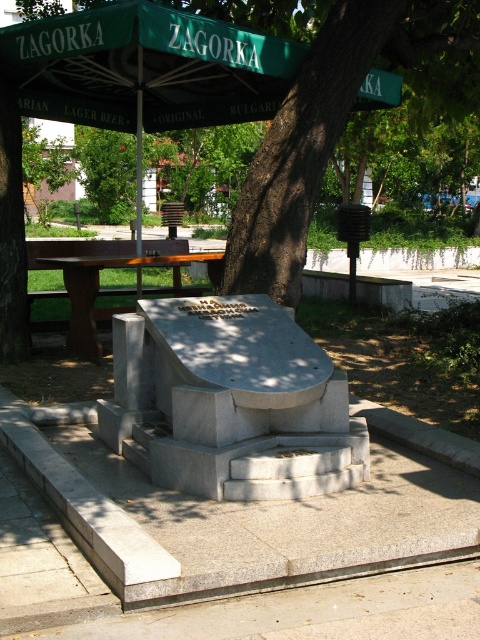
You are standing at point [52,504] and want to reach the monument. The path is 3.95 meters long. If you walk at 1.5 meters per second, how many seconds will it take you to reach the monument?

The distance between you and the monument is 3.95 meters. At a walking speed of 1.5 meters per second, it will take approximately 2.63 seconds to reach the monument.

You are standing at the base of the stone monument and want to take a photo of the green fabric umbrella at upper center. Which direction should you face to capture it in your shot?

The green fabric umbrella at upper center is located at point 0.106 on the x and 0.306 on the y axis, so you should face towards the upper center direction to capture it in your shot.